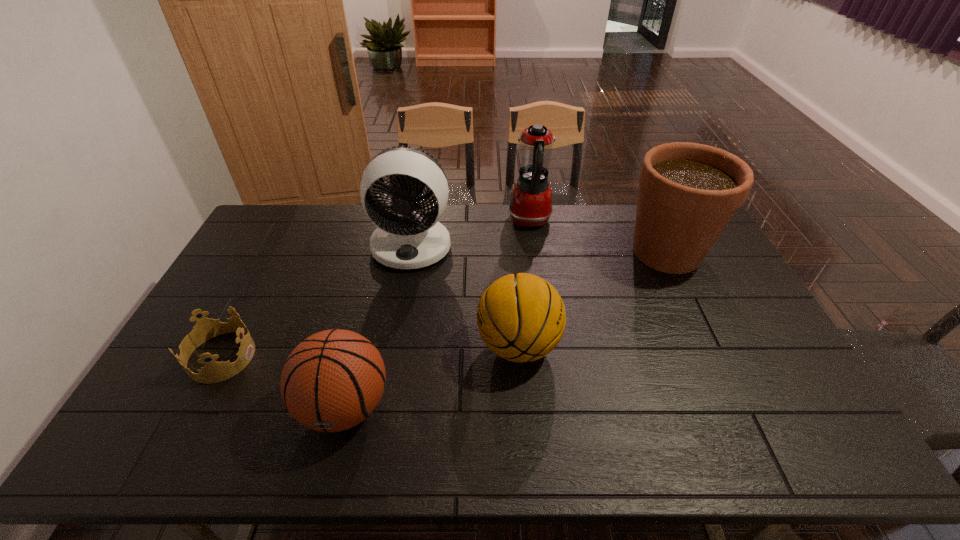
In order to click on food processor in this screenshot , I will do [530, 205].

Where is `fan`? This screenshot has width=960, height=540. fan is located at coordinates (413, 239).

At what (x,y) coordinates should I click in order to perform the action: click on the rightmost object. Please return your answer as a coordinate pair (x, y). Looking at the image, I should click on (688, 192).

What are the coordinates of `the right basketball` in the screenshot? It's located at point(520,318).

I want to click on the left basketball, so click(x=333, y=380).

Locate an element on the screen. the shortest object is located at coordinates (213, 372).

The image size is (960, 540). Identify the location of tiara. (213, 372).

I want to click on free space located on the controls of the food processor, so click(x=495, y=220).

Where is `free space located on the controls of the food processor`? The height and width of the screenshot is (540, 960). free space located on the controls of the food processor is located at coordinates (409, 220).

Where is `vacant space situated 0.210m on the controls of the food processor`? vacant space situated 0.210m on the controls of the food processor is located at coordinates (453, 220).